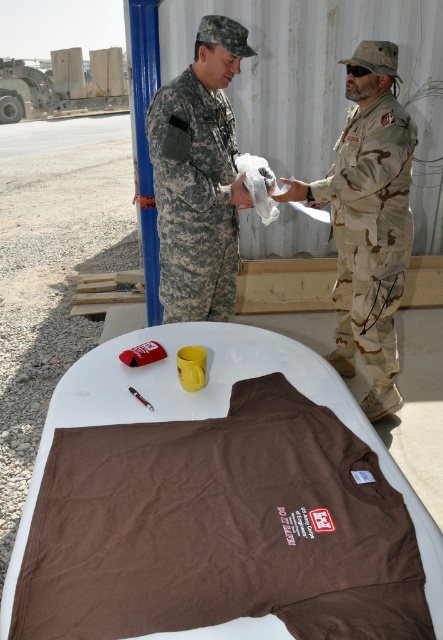
Question: Is camouflage fabric uniform at right wider than camouflage fabric uniform at center?

Choices:
 (A) yes
 (B) no

Answer: (A)

Question: Which point is farther from the camera taking this photo?

Choices:
 (A) (380, 106)
 (B) (222, 269)

Answer: (B)

Question: From the image, what is the correct spatial relationship of camouflage fabric uniform at right in relation to camouflage fabric uniform at center?

Choices:
 (A) right
 (B) left

Answer: (A)

Question: Does camouflage fabric uniform at right come in front of camouflage fabric uniform at center?

Choices:
 (A) no
 (B) yes

Answer: (A)

Question: Which point is closer to the camera taking this photo?

Choices:
 (A) (174, 264)
 (B) (335, 216)

Answer: (A)

Question: Which point is farther from the camera taking this photo?

Choices:
 (A) (234, 278)
 (B) (361, 330)

Answer: (A)